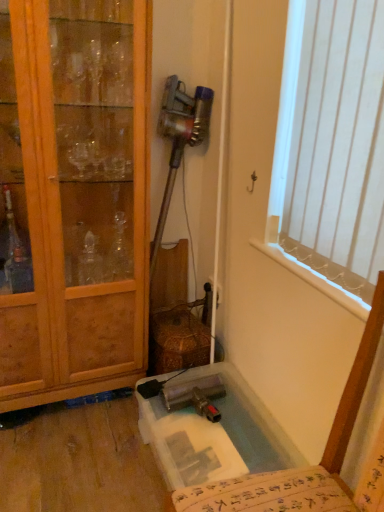
Question: Is translucent plastic chair at lower right taller or shorter than white vertical blinds at upper right?

Choices:
 (A) tall
 (B) short

Answer: (A)

Question: Is translucent plastic chair at lower right in front of or behind white vertical blinds at upper right in the image?

Choices:
 (A) front
 (B) behind

Answer: (A)

Question: Which is farther from the wooden cabinet at left?

Choices:
 (A) clear plastic bath at lower center
 (B) white vertical blinds at upper right
 (C) translucent plastic chair at lower right

Answer: (C)

Question: Estimate the real-world distances between objects in this image. Which object is closer to the white vertical blinds at upper right?

Choices:
 (A) clear plastic bath at lower center
 (B) wooden cabinet at left
 (C) translucent plastic chair at lower right

Answer: (C)